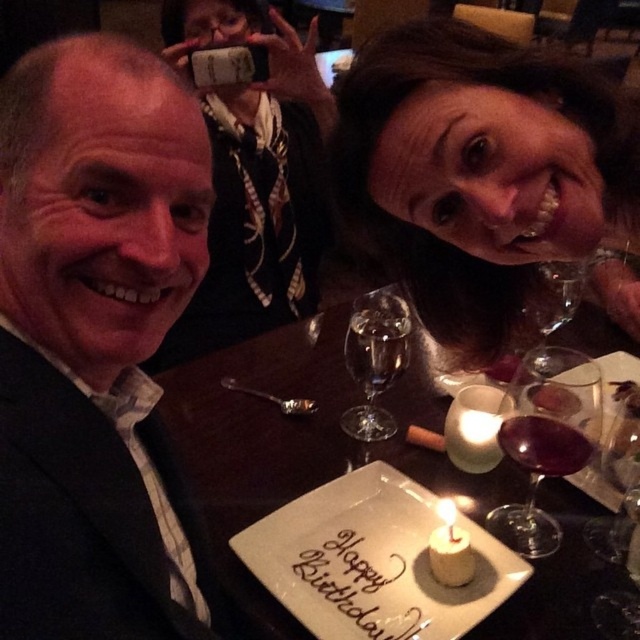
Question: Does matte black hair at upper center have a smaller size compared to transparent glass wine glass at lower right?

Choices:
 (A) no
 (B) yes

Answer: (A)

Question: Which of the following is the closest to the observer?

Choices:
 (A) clear glass wine glass at upper right
 (B) dark red glass at center
 (C) white wax candle at center
 (D) white ceramic plate at center

Answer: (D)

Question: Considering the relative positions of clear glass wine glass at center and transparent glass wine glass at lower right in the image provided, where is clear glass wine glass at center located with respect to transparent glass wine glass at lower right?

Choices:
 (A) below
 (B) above

Answer: (B)

Question: Observing the image, what is the correct spatial positioning of white ceramic plate at center in reference to transparent glass wine glass at lower right?

Choices:
 (A) above
 (B) below

Answer: (A)

Question: Which object is closer to the camera taking this photo?

Choices:
 (A) white ceramic plate at center
 (B) translucent glass wine glass at center

Answer: (A)

Question: Which object is farther from the camera taking this photo?

Choices:
 (A) dark red glass at center
 (B) matte black suit at left
 (C) transparent glass wine glass at lower right
 (D) translucent glass wine glass at center

Answer: (C)